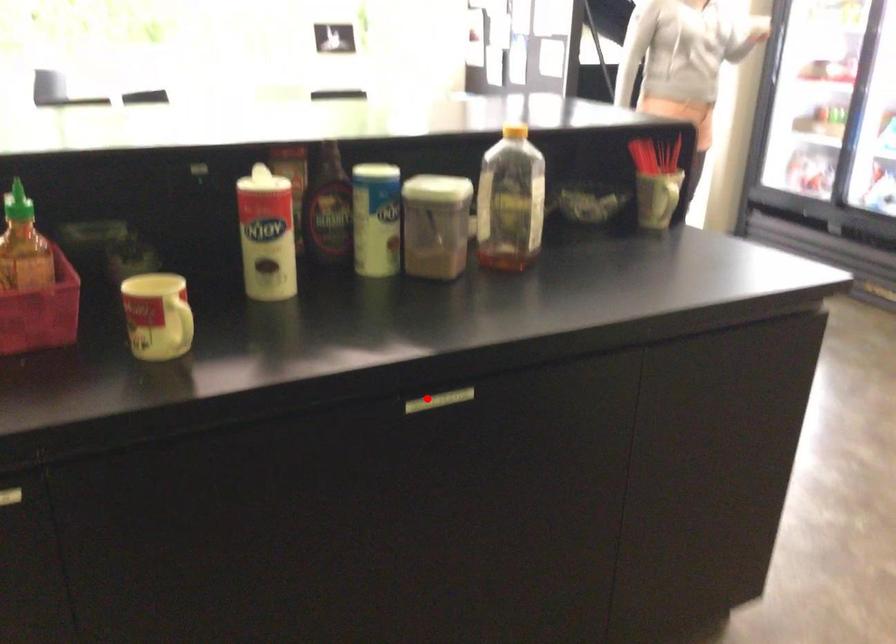
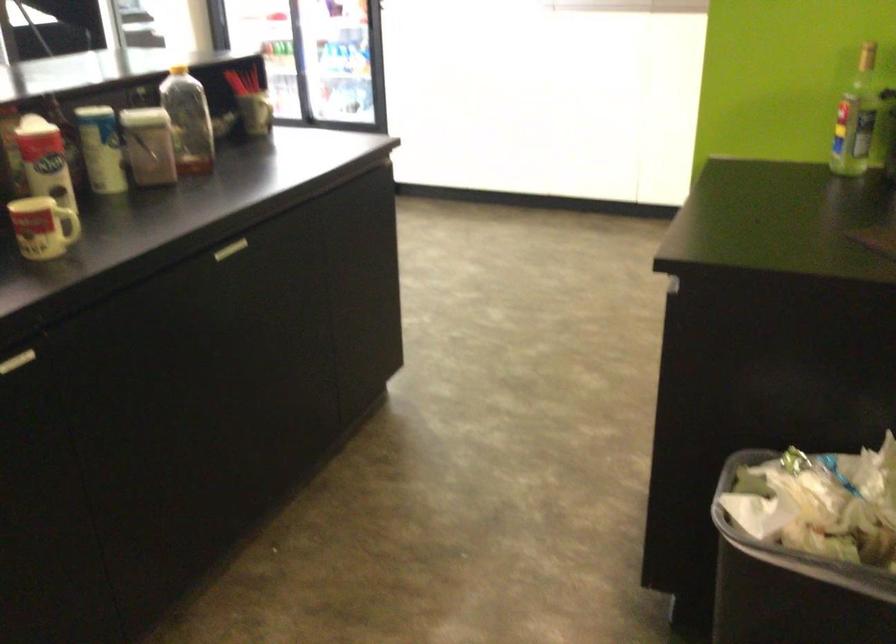
Question: I am providing you with two images of the same scene from different viewpoints. A red point is shown in image1. For the corresponding object point in image2, is it positioned nearer or farther from the camera?

Choices:
 (A) Nearer
 (B) Farther

Answer: (B)